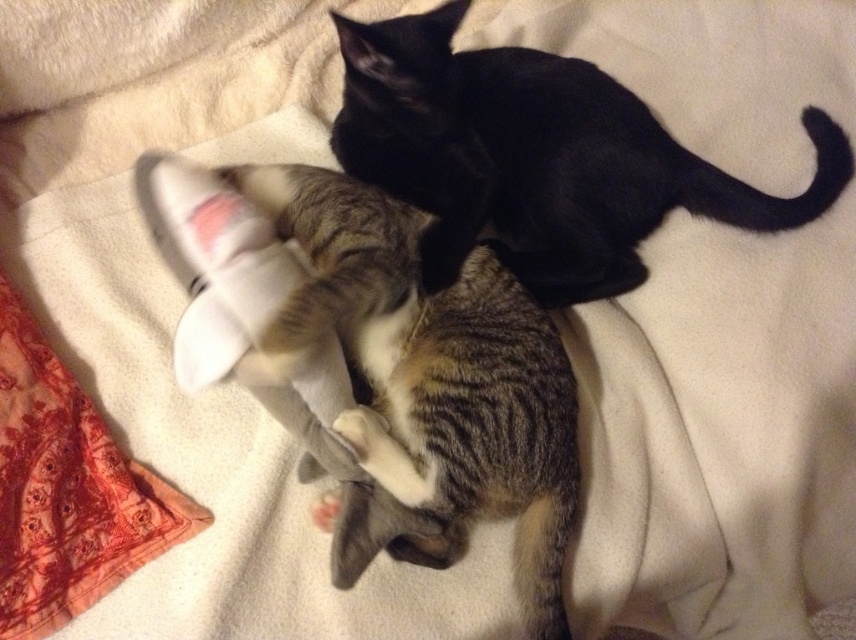
You are trying to locate a specific point on the image. The point is at coordinates point (434, 376). Which cat is this point located on?

The point (434, 376) is located on the striped fur cat at center.

You are observing two cats on a blanket. The striped fur cat at center and the black cat on the right. Which cat is closer to the edge of the blanket?

The black cat on the right is closer to the edge of the blanket because the striped fur cat at center is located at point (434, 376), which is near the center, implying the black cat is further out.

You are a photographer trying to capture a closeup of the striped fur cat at center without the black glossy cat at upper center appearing in the frame. Can you position yourself in a way that allows you to do this?

Yes, since the striped fur cat at center is located below the black glossy cat at upper center, you can position yourself lower to frame the striped fur cat at center while keeping the black glossy cat at upper center out of the shot.